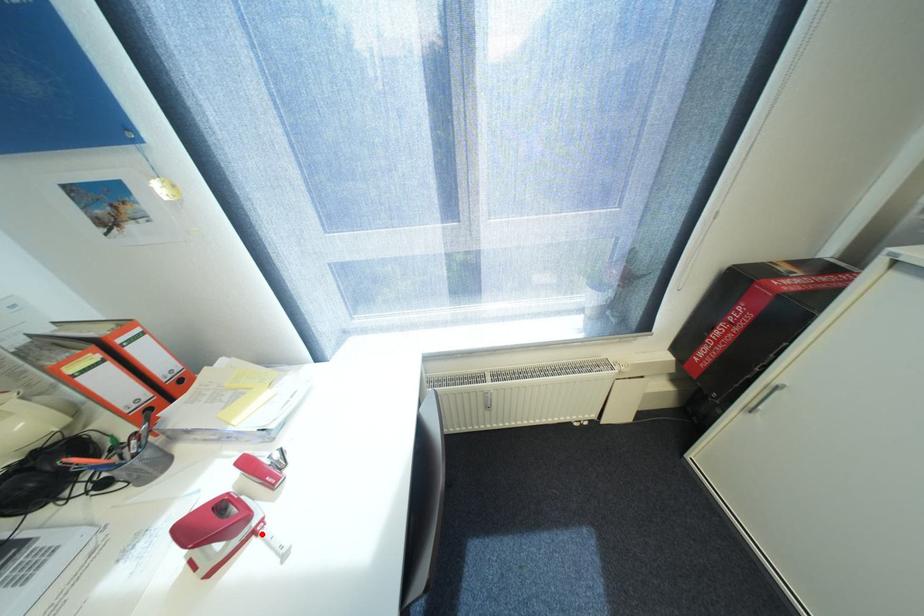
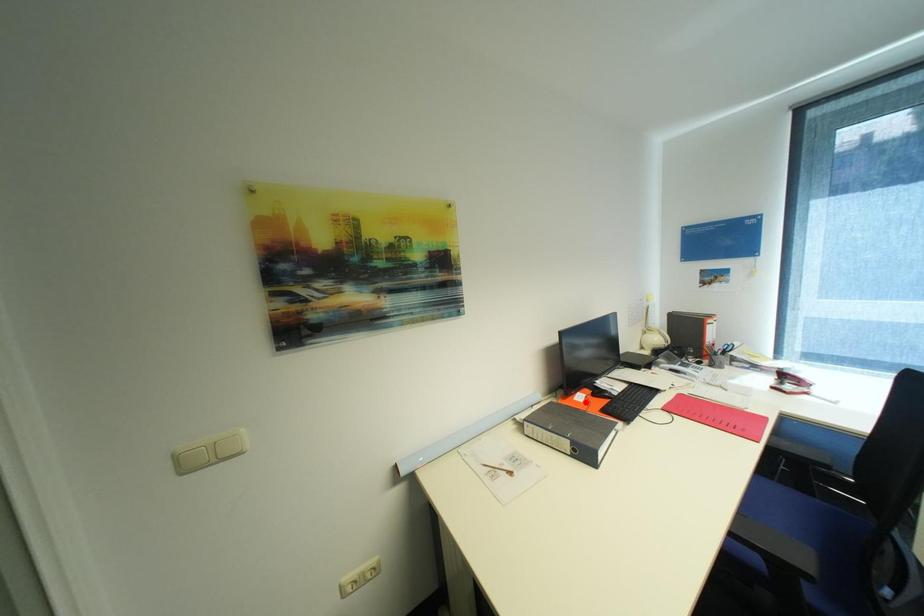
I am providing you with two images of the same scene from different viewpoints. A red point is marked on the first image and another point is marked on the second image. Is the marked point in image1 the same physical position as the marked point in image2?

No